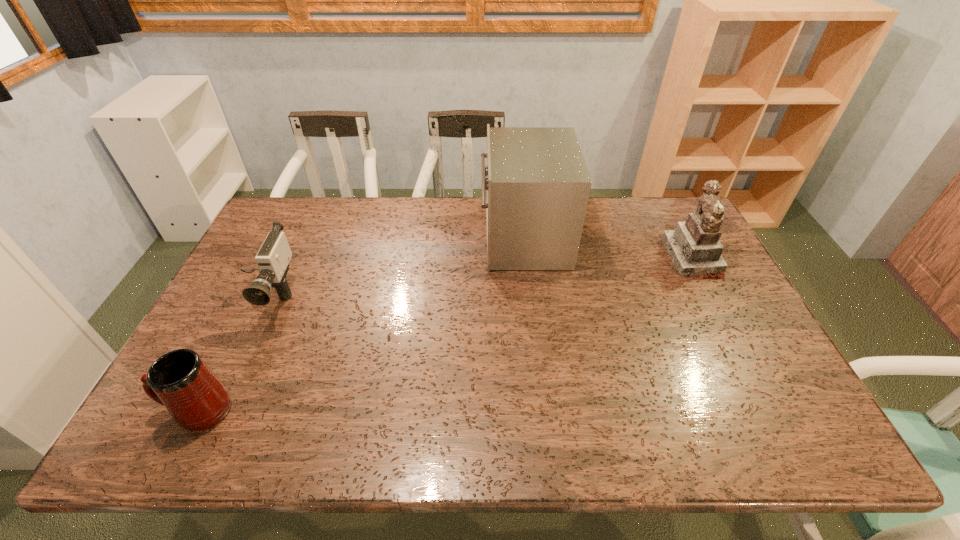
This screenshot has width=960, height=540. In order to click on free space located on the front-facing side of the rightmost object in this screenshot , I will do click(x=584, y=258).

Where is `blank space located on the front-facing side of the rightmost object`? The width and height of the screenshot is (960, 540). blank space located on the front-facing side of the rightmost object is located at coordinates (584, 258).

In order to click on free region located on the recording direction of the camcorder in this screenshot , I will do `click(200, 439)`.

You are a GUI agent. You are given a task and a screenshot of the screen. Output one action in this format:
    pyautogui.click(x=<x>, y=<y>)
    Task: Click on the toaster oven at the far edge
    The width and height of the screenshot is (960, 540).
    Given the screenshot: What is the action you would take?
    pyautogui.click(x=537, y=184)

In order to click on figurine positioned at the far edge in this screenshot , I will do `click(694, 247)`.

Locate an element on the screen. This screenshot has height=540, width=960. object at the near edge is located at coordinates (180, 380).

Find the location of `camcorder that is at the left edge`. camcorder that is at the left edge is located at coordinates (273, 257).

Identify the location of mug that is at the left edge. The height and width of the screenshot is (540, 960). (180, 380).

Find the location of a particular element. This screenshot has height=540, width=960. object that is at the right edge is located at coordinates (694, 247).

Identify the location of object present at the near left corner. The width and height of the screenshot is (960, 540). [x=180, y=380].